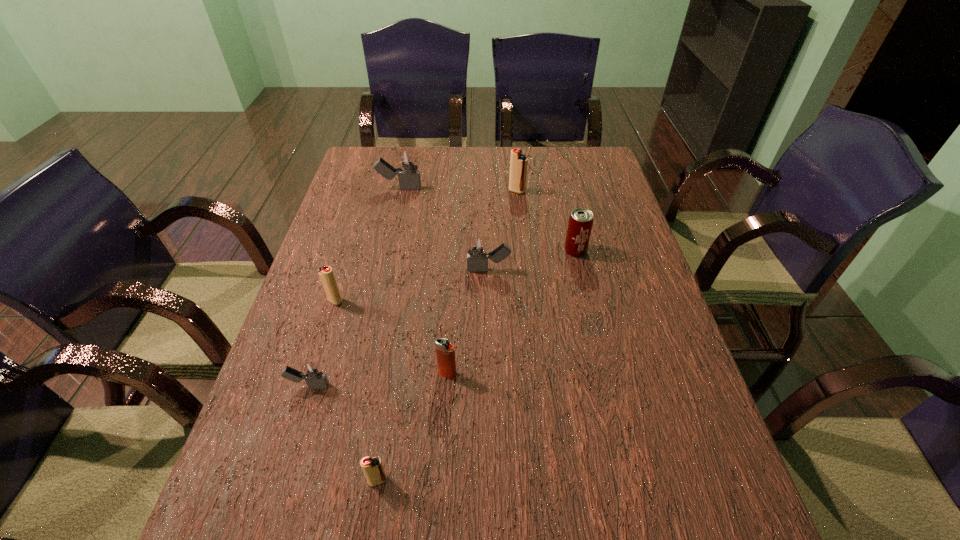
Find the location of a particular element. vacant space in between the nearest object and the biggest red igniter is located at coordinates (447, 336).

The height and width of the screenshot is (540, 960). What are the coordinates of `free space between the rightmost red igniter and the second smallest red igniter` in the screenshot? It's located at (426, 246).

Where is `empty space that is in between the farthest red igniter and the second farthest gray igniter`? empty space that is in between the farthest red igniter and the second farthest gray igniter is located at coordinates (503, 231).

This screenshot has height=540, width=960. I want to click on unoccupied position between the sixth nearest object and the rightmost gray igniter, so (x=532, y=260).

Locate an element on the screen. The image size is (960, 540). free space that is in between the farthest gray igniter and the nearest object is located at coordinates (389, 334).

Image resolution: width=960 pixels, height=540 pixels. What are the coordinates of `vacant space that's between the nearest red igniter and the second nearest red igniter` in the screenshot? It's located at (356, 390).

Where is `the seventh closest object to the rightmost igniter`? The image size is (960, 540). the seventh closest object to the rightmost igniter is located at coordinates (373, 469).

The image size is (960, 540). I want to click on object that ranks as the seventh closest to the second nearest red igniter, so click(518, 162).

You are a GUI agent. You are given a task and a screenshot of the screen. Output one action in this format:
    pyautogui.click(x=<x>, y=<y>)
    Task: Click on the second closest igniter to the rightmost object
    
    Given the screenshot: What is the action you would take?
    pyautogui.click(x=518, y=162)

Locate which igniter ranks fourth in proximity to the rightmost red igniter. Please provide its 2D coordinates. Your answer should be formatted as a tuple, i.e. [(x, y)], where the tuple contains the x and y coordinates of a point satisfying the conditions above.

[(445, 352)]